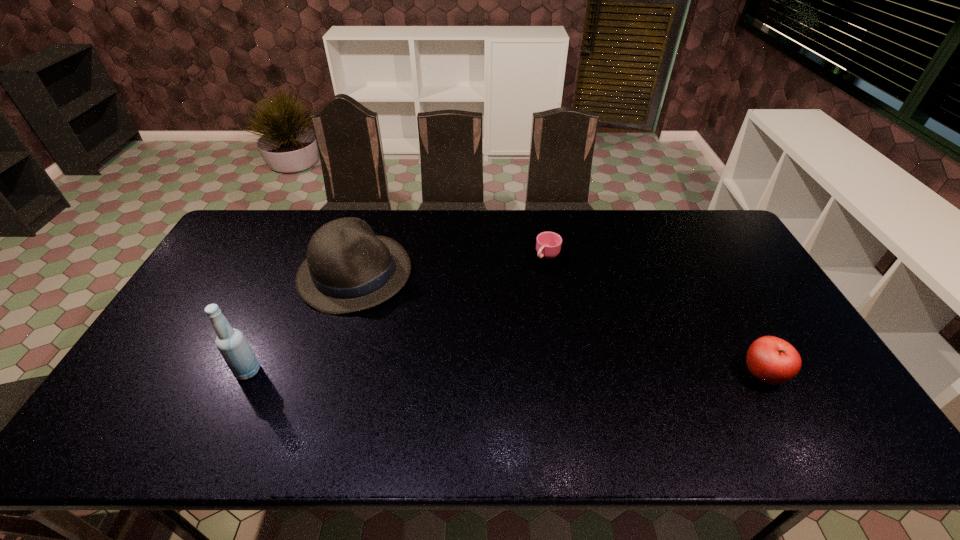
The height and width of the screenshot is (540, 960). In order to click on blank space at the far edge of the desktop in this screenshot , I will do tap(574, 215).

This screenshot has height=540, width=960. In the image, there is a desktop. What are the coordinates of `free space at the left edge` in the screenshot? It's located at (219, 287).

Image resolution: width=960 pixels, height=540 pixels. Identify the location of free space at the right edge of the desktop. (719, 275).

The height and width of the screenshot is (540, 960). I want to click on free spot at the near left corner of the desktop, so click(176, 399).

You are a GUI agent. You are given a task and a screenshot of the screen. Output one action in this format:
    pyautogui.click(x=<x>, y=<y>)
    Task: Click on the vacant space at the far right corner
    The image size is (960, 540).
    Given the screenshot: What is the action you would take?
    pyautogui.click(x=693, y=219)

Locate an element on the screen. The image size is (960, 540). empty location between the bowler hat and the third object from left to right is located at coordinates (451, 265).

Locate an element on the screen. free space between the third shortest object and the second shortest object is located at coordinates (559, 324).

Locate an element on the screen. Image resolution: width=960 pixels, height=540 pixels. vacant space that is in between the bottle and the rightmost object is located at coordinates (505, 373).

You are a GUI agent. You are given a task and a screenshot of the screen. Output one action in this format:
    pyautogui.click(x=<x>, y=<y>)
    Task: Click on the empty space that is in between the third shortest object and the cup
    The width and height of the screenshot is (960, 540).
    Given the screenshot: What is the action you would take?
    pyautogui.click(x=451, y=265)

This screenshot has height=540, width=960. I want to click on vacant area that lies between the bottle and the third tallest object, so click(x=505, y=373).